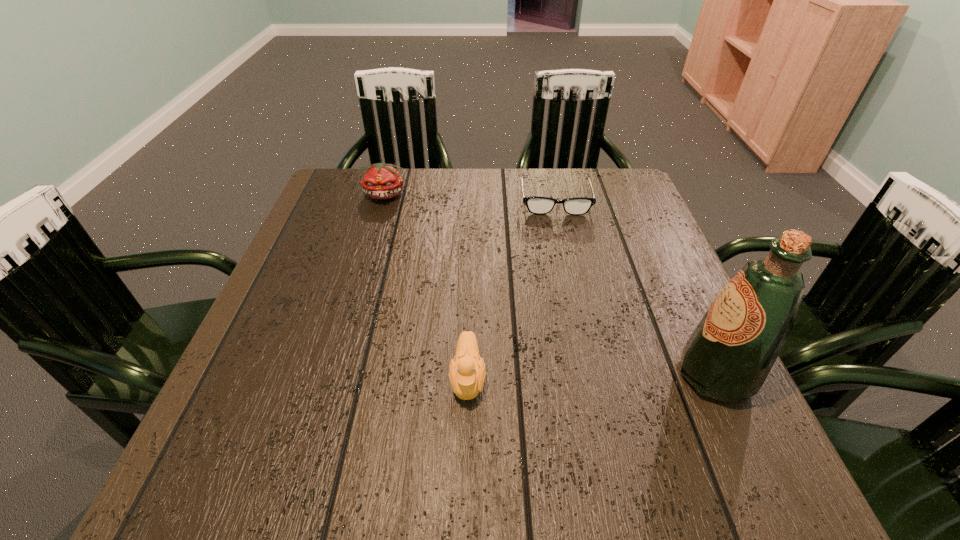
You are a GUI agent. You are given a task and a screenshot of the screen. Output one action in this format:
    pyautogui.click(x=<x>, y=<y>)
    Task: Click on the vacant region at the near left corner of the desktop
    This screenshot has width=960, height=540.
    Given the screenshot: What is the action you would take?
    pyautogui.click(x=276, y=417)

At what (x,y) coordinates should I click in order to perform the action: click on vacant space at the far right corner of the desktop. Please return your answer as a coordinate pair (x, y). This screenshot has height=540, width=960. Looking at the image, I should click on (608, 196).

You are a GUI agent. You are given a task and a screenshot of the screen. Output one action in this format:
    pyautogui.click(x=<x>, y=<y>)
    Task: Click on the vacant space at the near right corner of the desktop
    
    Given the screenshot: What is the action you would take?
    pyautogui.click(x=748, y=425)

Locate an element on the screen. Image resolution: width=960 pixels, height=540 pixels. free space that is in between the olive oil and the second object from left to right is located at coordinates (591, 377).

Locate an element on the screen. free space between the leftmost object and the tallest object is located at coordinates (550, 286).

I want to click on vacant area that lies between the third object from right to left and the tomato, so click(426, 287).

The height and width of the screenshot is (540, 960). I want to click on vacant point located between the tallest object and the third object from left to right, so click(x=636, y=288).

Find the location of `vacant space in between the shortest object and the second object from left to right`. vacant space in between the shortest object and the second object from left to right is located at coordinates (512, 289).

Where is `vacant area that lies between the leftmost object and the tallest object`? vacant area that lies between the leftmost object and the tallest object is located at coordinates click(550, 286).

Find the location of a particular element. free point between the tomato and the tallest object is located at coordinates (550, 286).